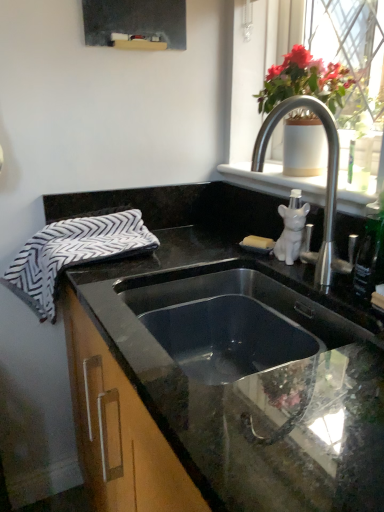
Question: Is white ceramic dog at upper right completely or partially inside white matte soap dispenser at upper right?

Choices:
 (A) yes
 (B) no

Answer: (B)

Question: Is white matte soap dispenser at upper right further to camera compared to white ceramic dog at upper right?

Choices:
 (A) no
 (B) yes

Answer: (A)

Question: From a real-world perspective, is white matte soap dispenser at upper right located beneath white ceramic dog at upper right?

Choices:
 (A) no
 (B) yes

Answer: (A)

Question: Can you confirm if white matte soap dispenser at upper right is shorter than white ceramic dog at upper right?

Choices:
 (A) yes
 (B) no

Answer: (A)

Question: Considering the relative positions of white matte soap dispenser at upper right and white ceramic dog at upper right in the image provided, is white matte soap dispenser at upper right to the left of white ceramic dog at upper right from the viewer's perspective?

Choices:
 (A) yes
 (B) no

Answer: (B)

Question: Is white matte soap dispenser at upper right beside white ceramic dog at upper right?

Choices:
 (A) no
 (B) yes

Answer: (A)

Question: Does white ceramic vase at upper right turn towards black granite countertop at center?

Choices:
 (A) no
 (B) yes

Answer: (A)

Question: Can you confirm if white ceramic vase at upper right is shorter than black granite countertop at center?

Choices:
 (A) no
 (B) yes

Answer: (B)

Question: Considering the relative sizes of white ceramic vase at upper right and black granite countertop at center in the image provided, is white ceramic vase at upper right smaller than black granite countertop at center?

Choices:
 (A) no
 (B) yes

Answer: (B)

Question: From the image's perspective, is white ceramic vase at upper right located beneath black granite countertop at center?

Choices:
 (A) no
 (B) yes

Answer: (A)

Question: Considering the relative positions of white ceramic vase at upper right and black granite countertop at center in the image provided, is white ceramic vase at upper right in front of black granite countertop at center?

Choices:
 (A) no
 (B) yes

Answer: (A)

Question: Considering the relative sizes of white ceramic vase at upper right and black granite countertop at center in the image provided, is white ceramic vase at upper right thinner than black granite countertop at center?

Choices:
 (A) no
 (B) yes

Answer: (B)

Question: Does satin nickel faucet at upper right have a greater height compared to white ceramic dog at upper right?

Choices:
 (A) no
 (B) yes

Answer: (B)